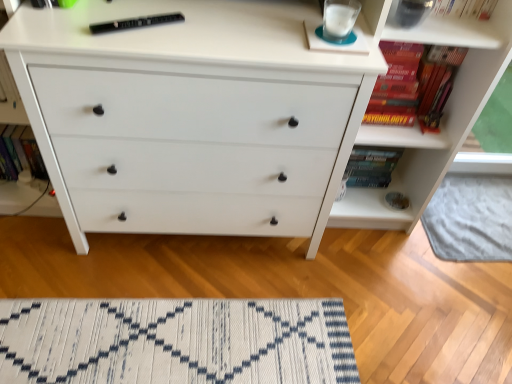
You are a GUI agent. You are given a task and a screenshot of the screen. Output one action in this format:
    pyautogui.click(x=<x>, y=<y>)
    Task: Click on the free space above white woven mat at lower center (from a real-world perspective)
    The image size is (512, 384).
    Given the screenshot: What is the action you would take?
    pyautogui.click(x=120, y=347)